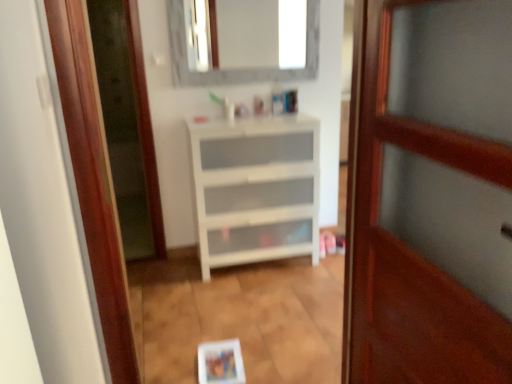
Question: In terms of height, does wooden door at center look taller or shorter compared to white matte chest of drawers at center?

Choices:
 (A) short
 (B) tall

Answer: (B)

Question: In terms of size, does wooden door at center appear bigger or smaller than white matte chest of drawers at center?

Choices:
 (A) small
 (B) big

Answer: (A)

Question: Based on their relative distances, which object is nearer to the wooden door at center?

Choices:
 (A) white matte chest of drawers at center
 (B) white marble mirror at upper center

Answer: (A)

Question: Based on their relative distances, which object is nearer to the white marble mirror at upper center?

Choices:
 (A) white matte chest of drawers at center
 (B) wooden door at center

Answer: (A)